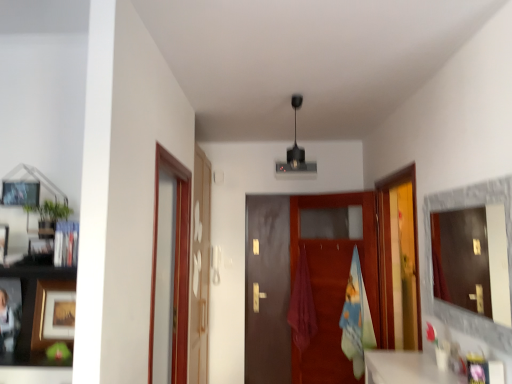
Question: Does wooden picture frame at left, which ranks as the second picture frame in top-to-bottom order, have a greater width compared to transparent glass door at right, which appears as the first glass door when viewed from the right?

Choices:
 (A) yes
 (B) no

Answer: (B)

Question: Does wooden picture frame at left, marked as the 2th picture frame in a bottom-to-top arrangement, lie behind transparent glass door at right, which is the 3th glass door from left to right?

Choices:
 (A) no
 (B) yes

Answer: (A)

Question: Does wooden picture frame at left, which is counted as the third picture frame, starting from the back, contain transparent glass door at right, which is the 3th glass door from left to right?

Choices:
 (A) yes
 (B) no

Answer: (B)

Question: Is wooden picture frame at left, which ranks as the second picture frame in top-to-bottom order, positioned with its back to transparent glass door at right, which is the 3th glass door from left to right?

Choices:
 (A) yes
 (B) no

Answer: (B)

Question: From a real-world perspective, is wooden picture frame at left, which ranks as the second picture frame in top-to-bottom order, physically above transparent glass door at right, which is the 3th glass door from left to right?

Choices:
 (A) yes
 (B) no

Answer: (A)

Question: From the image's perspective, is wooden picture frame at left, marked as the 2th picture frame in a bottom-to-top arrangement, located beneath transparent glass door at right, which is the 3th glass door from left to right?

Choices:
 (A) no
 (B) yes

Answer: (A)

Question: From a real-world perspective, is blue cotton bath towel at center positioned under matte black picture frame at upper left, which is the second picture frame in front-to-back order, based on gravity?

Choices:
 (A) yes
 (B) no

Answer: (A)

Question: Does blue cotton bath towel at center come behind matte black picture frame at upper left, which is the second picture frame in front-to-back order?

Choices:
 (A) yes
 (B) no

Answer: (A)

Question: Does blue cotton bath towel at center appear on the right side of matte black picture frame at upper left, acting as the 2th picture frame starting from the back?

Choices:
 (A) yes
 (B) no

Answer: (A)

Question: From a real-world perspective, is blue cotton bath towel at center on matte black picture frame at upper left, acting as the first picture frame starting from the top?

Choices:
 (A) no
 (B) yes

Answer: (A)

Question: Is blue cotton bath towel at center thinner than matte black picture frame at upper left, which appears as the 3th picture frame when ordered from the bottom?

Choices:
 (A) yes
 (B) no

Answer: (B)

Question: Does blue cotton bath towel at center have a lesser height compared to matte black picture frame at upper left, acting as the first picture frame starting from the top?

Choices:
 (A) no
 (B) yes

Answer: (A)

Question: From the image's perspective, is transparent glass door at left, the 2th glass door when ordered from left to right, under transparent glass door at right, which appears as the first glass door when viewed from the right?

Choices:
 (A) yes
 (B) no

Answer: (A)